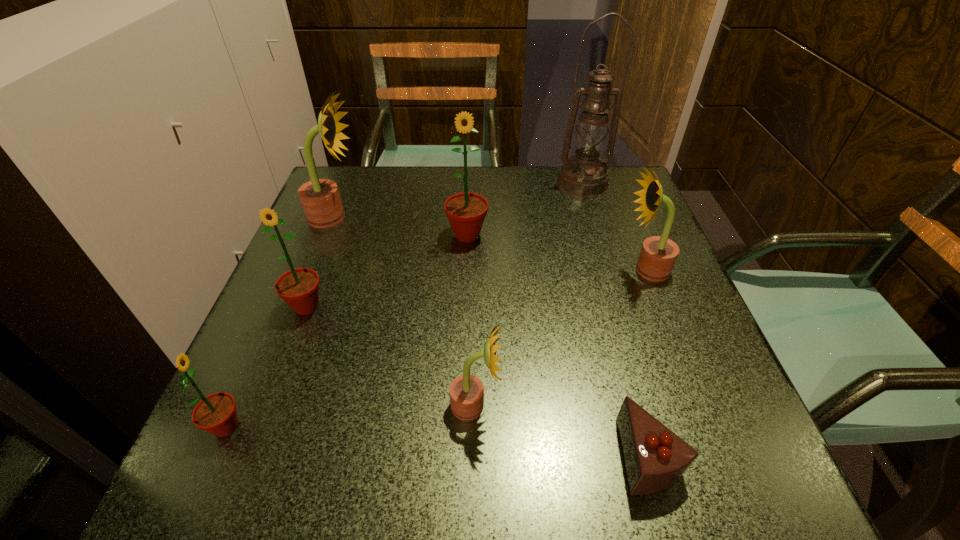
The width and height of the screenshot is (960, 540). Find the location of `free space between the second yellow sunflower from left to right and the chocolate cake`. free space between the second yellow sunflower from left to right and the chocolate cake is located at coordinates (562, 430).

Select which object appears as the closest to the smallest green sunflower. Please provide its 2D coordinates. Your answer should be formatted as a tuple, i.e. [(x, y)], where the tuple contains the x and y coordinates of a point satisfying the conditions above.

[(299, 288)]

The image size is (960, 540). What are the coordinates of `the sixth closest object to the tallest object` in the screenshot? It's located at (655, 458).

Find the location of a particular element. Image resolution: width=960 pixels, height=540 pixels. the fifth closest sunflower relative to the rightmost green sunflower is located at coordinates (216, 413).

The height and width of the screenshot is (540, 960). I want to click on the fifth closest sunflower to the farthest yellow sunflower, so click(658, 254).

Find the location of a particular element. The height and width of the screenshot is (540, 960). yellow sunflower identified as the closest to the second nearest green sunflower is located at coordinates [x=320, y=198].

Locate an element on the screen. Image resolution: width=960 pixels, height=540 pixels. the closest yellow sunflower relative to the fifth farthest object is located at coordinates (320, 198).

Choose which green sunflower is the nearest neighbor to the oil lamp. Please provide its 2D coordinates. Your answer should be formatted as a tuple, i.e. [(x, y)], where the tuple contains the x and y coordinates of a point satisfying the conditions above.

[(466, 212)]

Where is `green sunflower that stands as the closest to the rightmost yellow sunflower`? This screenshot has width=960, height=540. green sunflower that stands as the closest to the rightmost yellow sunflower is located at coordinates click(466, 212).

This screenshot has height=540, width=960. Find the location of `blank space that satisfies the following two spatial constraints: 1. on the face of the nearest green sunflower; 2. on the right side of the shortest object`. blank space that satisfies the following two spatial constraints: 1. on the face of the nearest green sunflower; 2. on the right side of the shortest object is located at coordinates (214, 455).